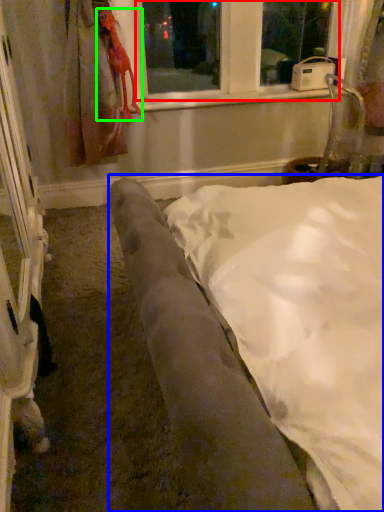
Question: Based on their relative distances, which object is nearer to bay window (highlighted by a red box)? Choose from furniture (highlighted by a blue box) and animal (highlighted by a green box).

Choices:
 (A) furniture
 (B) animal

Answer: (B)